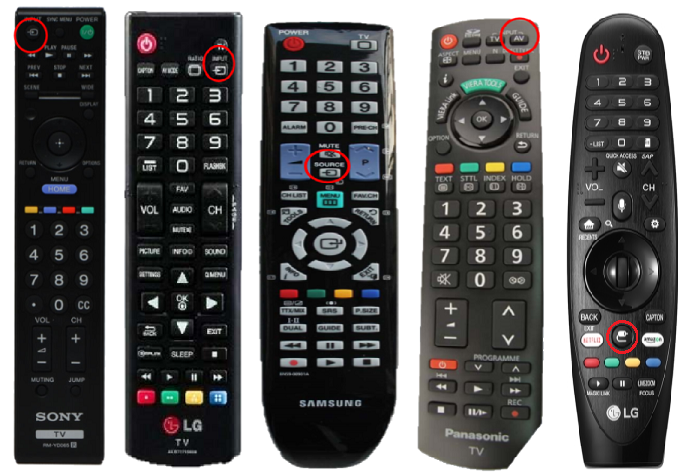
This screenshot has height=474, width=691. I want to click on remotes, so pos(66,161), pos(179,165), pos(316,169), pos(468,181), pos(645,187).